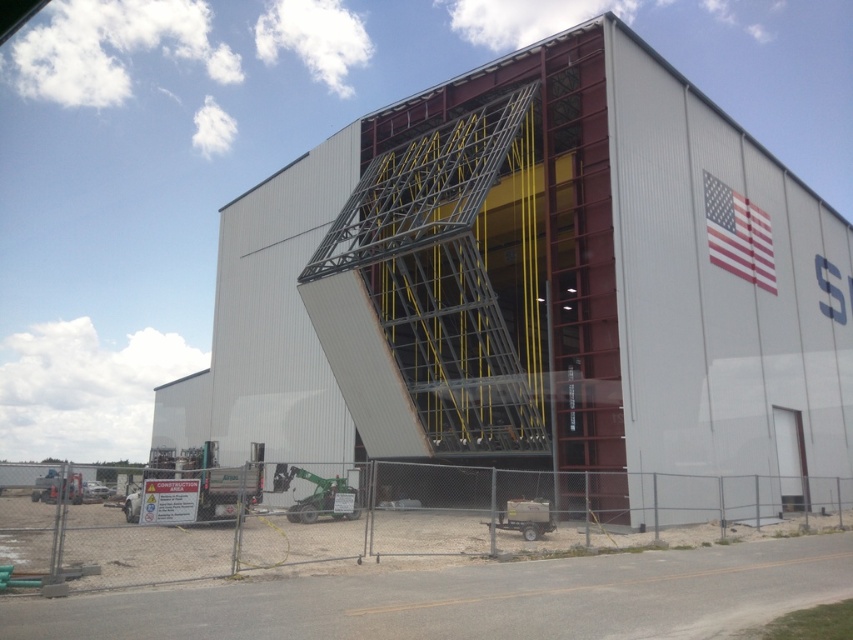
Can you confirm if metallic gray hangar at center is smaller than metal fence at lower center?

Actually, metallic gray hangar at center might be larger than metal fence at lower center.

Does metallic gray hangar at center appear on the right side of metal fence at lower center?

No, metallic gray hangar at center is not to the right of metal fence at lower center.

The height and width of the screenshot is (640, 853). I want to click on metallic gray hangar at center, so click(x=532, y=292).

Is point (630, 605) less distant than point (726, 244)?

That is True.

Who is more forward, (200,612) or (730,252)?

Point (200,612)

Is point (126, 561) in front of point (718, 266)?

Yes, it is in front of point (718, 266).

Locate an element on the screen. This screenshot has width=853, height=640. metal fence at lower center is located at coordinates (460, 566).

Which of these two, metallic gray hangar at center or american flag at upper right, stands taller?

metallic gray hangar at center is taller.

Can you confirm if metallic gray hangar at center is bigger than american flag at upper right?

Yes.

Is point (834, 298) more distant than point (741, 202)?

Yes, it is.

Find the location of a particular element. metallic gray hangar at center is located at coordinates (532, 292).